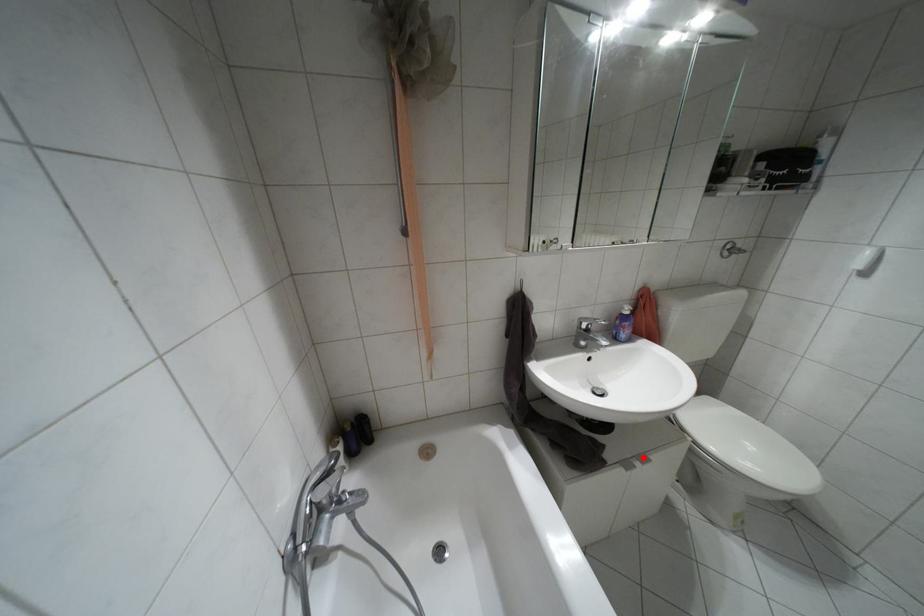
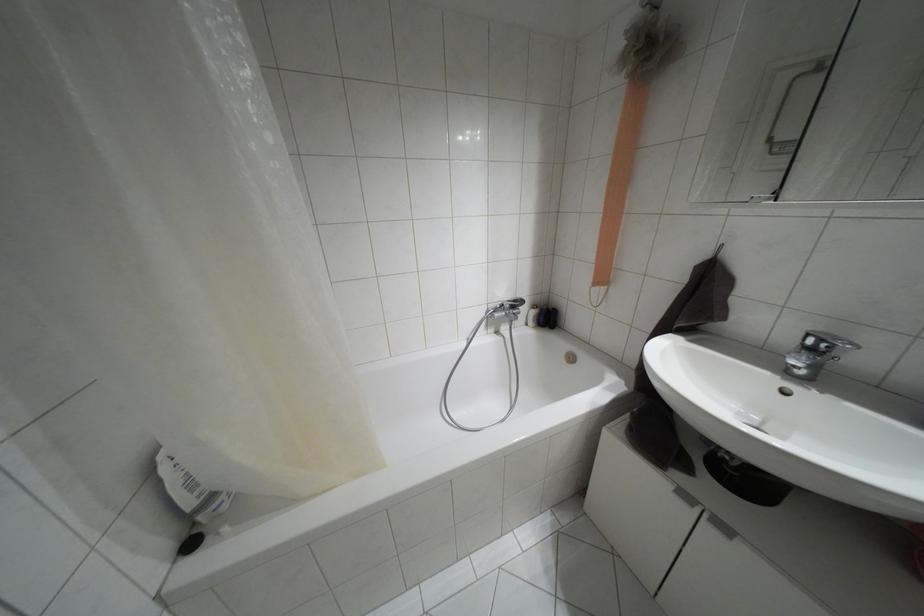
Find the pixel in the second image that matches the highlighted location in the first image.

(723, 528)